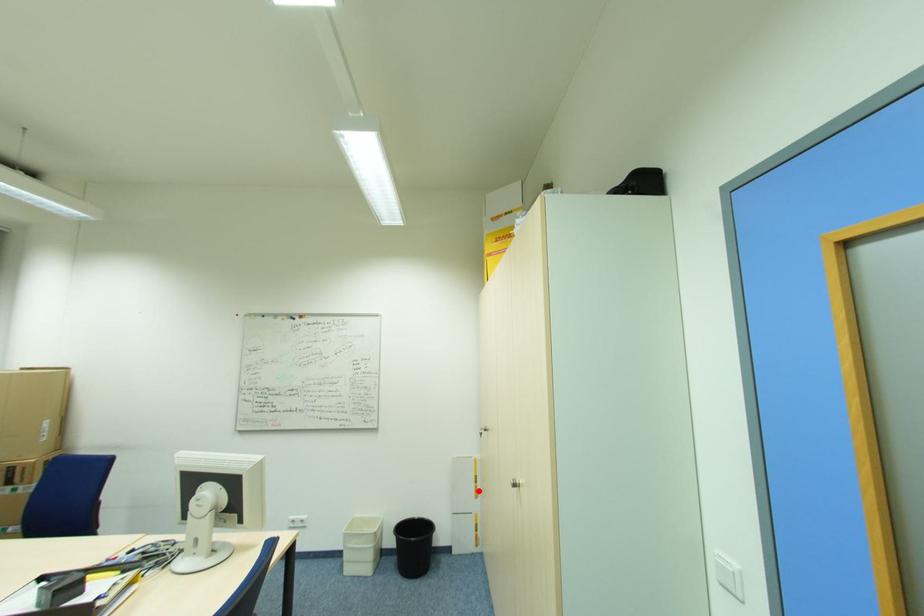
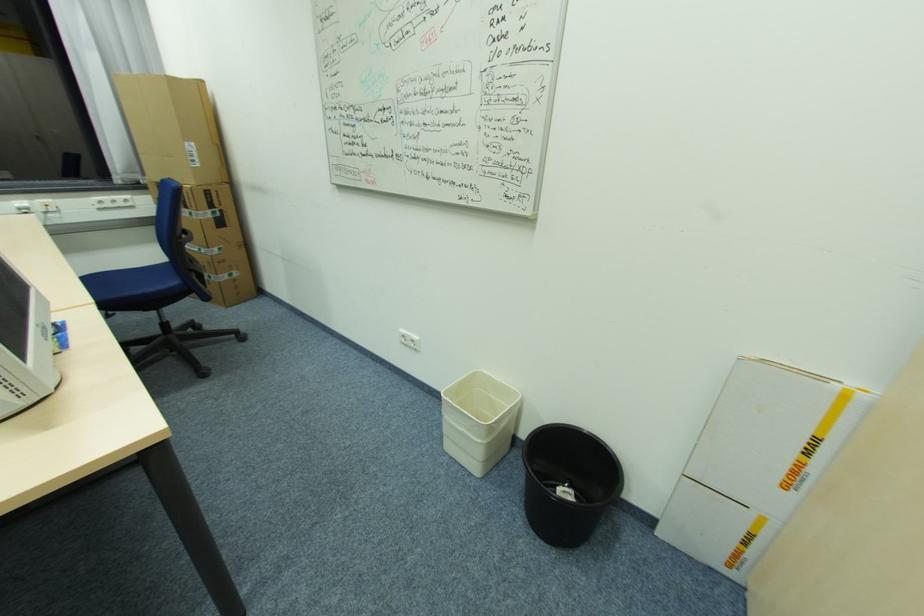
Question: A red point is marked in image1. In image2, is the corresponding 3D point closer to the camera or farther? Reply with the corresponding letter.

Choices:
 (A) The corresponding 3D point is closer.
 (B) The corresponding 3D point is farther.

Answer: (A)